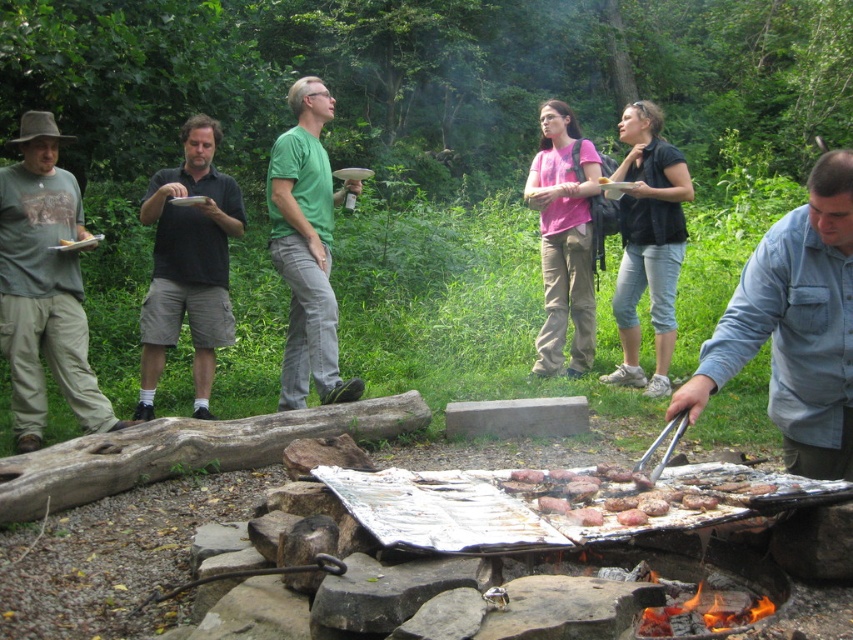
You are standing at the point with coordinates point (x=299, y=241) and want to walk towards the point (x=216, y=122). Which direction should you move?

You should move forward because point (x=216, y=122) is behind point (x=299, y=241), meaning it is in the direction you are facing.

You are standing at the point marked by the coordinates (793, 326) in the image. Looking around, you see a denim shirt at right and other objects. Which object is directly to your right?

The point marked by the coordinates (793, 326) is on the denim shirt at right, so the denim shirt at right is directly to your right.